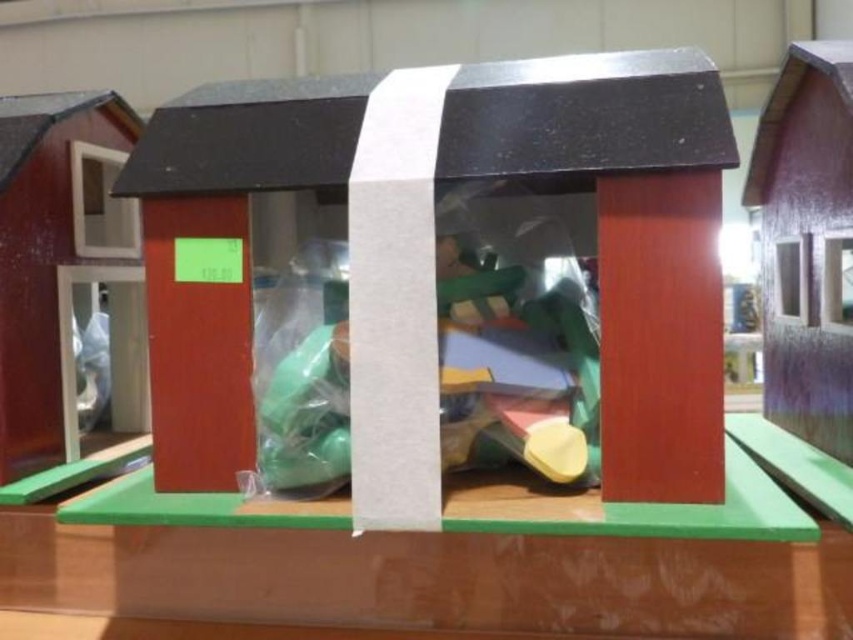
You are a child playing with the miniature houses. The matte plastic toys at center are part of your collection. If you want to place them exactly at the center of the first house, are they already positioned correctly?

The matte plastic toys at center are already positioned at the center of the first house since their coordinates are at point (517, 358), which aligns with the center point of the structure.

You are a child trying to reach both the matte plastic toys at center and the wooden barn door at left. Which object will your hand touch first if you extend your arm straight ahead?

The matte plastic toys at center will be touched first because they are closer to the viewer than the wooden barn door at left.